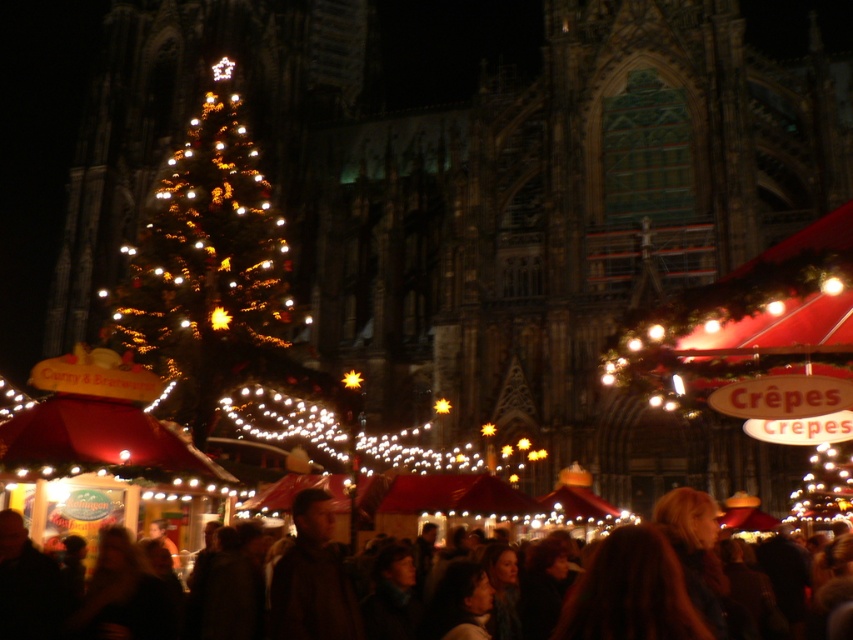
Question: Can you confirm if illuminated gold christmas tree at center is bigger than dark brown hair at lower center?

Choices:
 (A) yes
 (B) no

Answer: (A)

Question: Does illuminated gold christmas tree at center have a greater width compared to dark brown hair at lower center?

Choices:
 (A) no
 (B) yes

Answer: (A)

Question: Which point appears farthest from the camera in this image?

Choices:
 (A) (410, 476)
 (B) (215, 316)

Answer: (B)

Question: In this image, where is illuminated gold christmas tree at center located relative to dark brown hair at lower center?

Choices:
 (A) left
 (B) right

Answer: (A)

Question: Which point is closer to the camera?

Choices:
 (A) illuminated gold christmas tree at center
 (B) dark brown hair at lower center

Answer: (B)